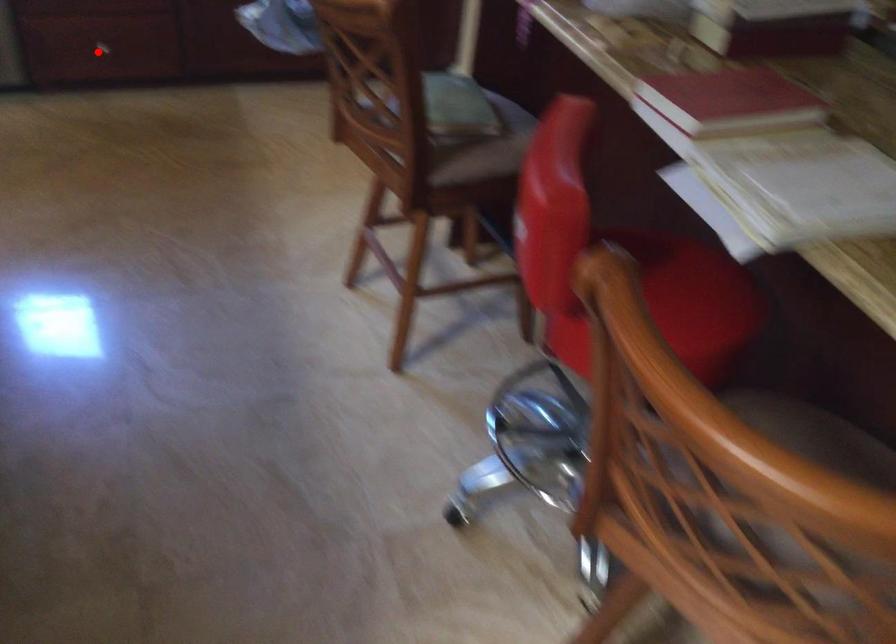
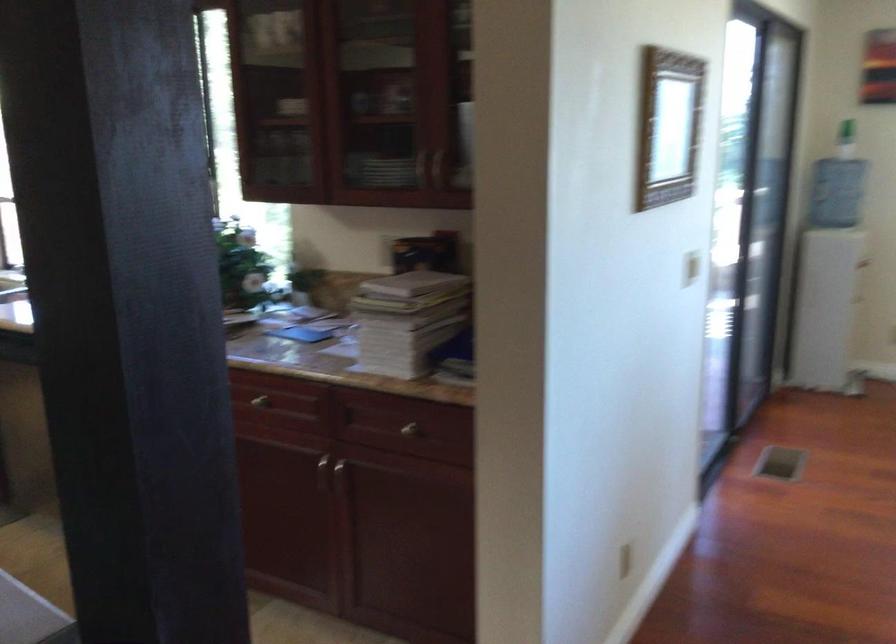
Question: I am providing you with two images of the same scene from different viewpoints. A red point is marked on the first image. Is the red point's position out of view in image 2?

Choices:
 (A) Yes
 (B) No

Answer: (A)